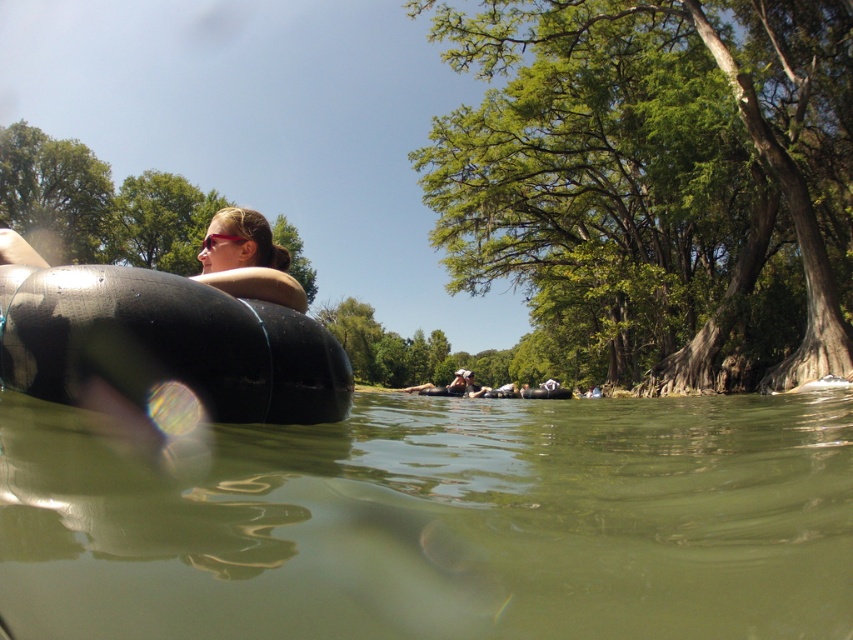
Question: Can you confirm if green murky water at lower center is positioned to the left of matte black tube at upper left?

Choices:
 (A) yes
 (B) no

Answer: (B)

Question: Estimate the real-world distances between objects in this image. Which object is farther from the green murky water at lower center?

Choices:
 (A) matte black tube at upper left
 (B) black rubber tube at left

Answer: (A)

Question: Based on their relative distances, which object is farther from the black rubber tube at left?

Choices:
 (A) matte black tube at upper left
 (B) green murky water at lower center

Answer: (B)

Question: Is green murky water at lower center below matte black tube at upper left?

Choices:
 (A) no
 (B) yes

Answer: (B)

Question: Can you confirm if black rubber tube at left is thinner than matte black tube at upper left?

Choices:
 (A) no
 (B) yes

Answer: (A)

Question: Which object is farther from the camera taking this photo?

Choices:
 (A) black rubber tube at left
 (B) matte black tube at upper left
 (C) green murky water at lower center

Answer: (B)